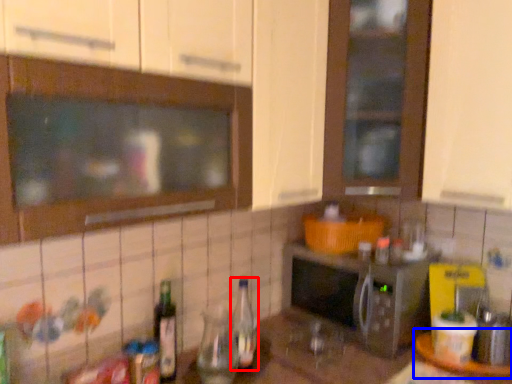
Question: Which point is closer to the camera, bottle (highlighted by a red box) or table (highlighted by a blue box)?

Choices:
 (A) bottle
 (B) table

Answer: (A)